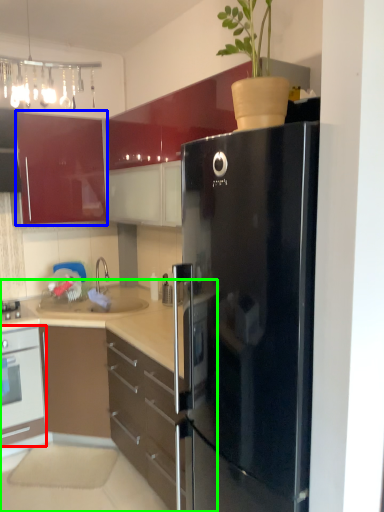
Question: Which is farther away from oven (highlighted by a red box)? cabinetry (highlighted by a blue box) or cabinetry (highlighted by a green box)?

Choices:
 (A) cabinetry
 (B) cabinetry

Answer: (A)